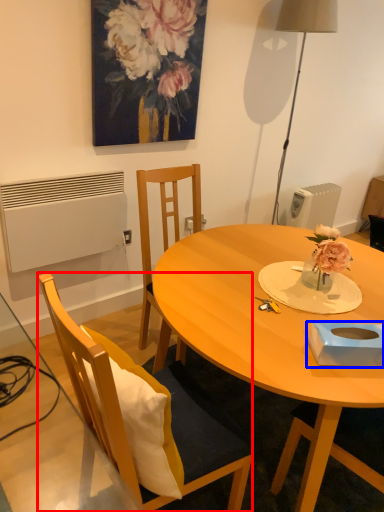
Question: Which object is closer to the camera taking this photo, chair (highlighted by a red box) or box (highlighted by a blue box)?

Choices:
 (A) chair
 (B) box

Answer: (A)